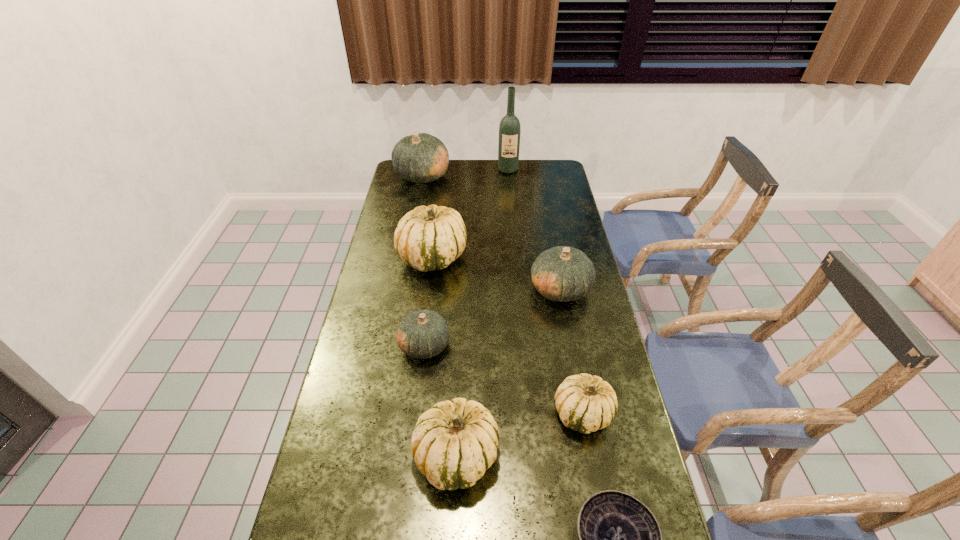
Image resolution: width=960 pixels, height=540 pixels. I want to click on free space between the nearest orange gourd and the farthest white gourd, so click(428, 301).

Identify which object is the third closest to the second smallest orange gourd. Please provide its 2D coordinates. Your answer should be formatted as a tuple, i.e. [(x, y)], where the tuple contains the x and y coordinates of a point satisfying the conditions above.

[(585, 403)]

Locate which object is the second closest to the second biggest white gourd. Please provide its 2D coordinates. Your answer should be formatted as a tuple, i.e. [(x, y)], where the tuple contains the x and y coordinates of a point satisfying the conditions above.

[(620, 539)]

The image size is (960, 540). In order to click on gourd that is the third closest to the fourth nearest object in this screenshot , I will do `click(562, 273)`.

Identify the location of gourd that stands as the third closest to the biggest orange gourd. (423, 334).

Identify which orange gourd is located as the nearest to the fourth nearest object. Please provide its 2D coordinates. Your answer should be formatted as a tuple, i.e. [(x, y)], where the tuple contains the x and y coordinates of a point satisfying the conditions above.

[(562, 273)]

Locate which orange gourd is the closest to the wine bottle. Please provide its 2D coordinates. Your answer should be formatted as a tuple, i.e. [(x, y)], where the tuple contains the x and y coordinates of a point satisfying the conditions above.

[(419, 158)]

Point out which white gourd is positioned as the nearest to the biggest orange gourd. Please provide its 2D coordinates. Your answer should be formatted as a tuple, i.e. [(x, y)], where the tuple contains the x and y coordinates of a point satisfying the conditions above.

[(430, 238)]

Identify the location of the second closest white gourd to the smallest white gourd. (430, 238).

Locate an element on the screen. vacant space that satisfies the following two spatial constraints: 1. on the labeled side of the smallest white gourd; 2. on the right side of the tallest object is located at coordinates (530, 414).